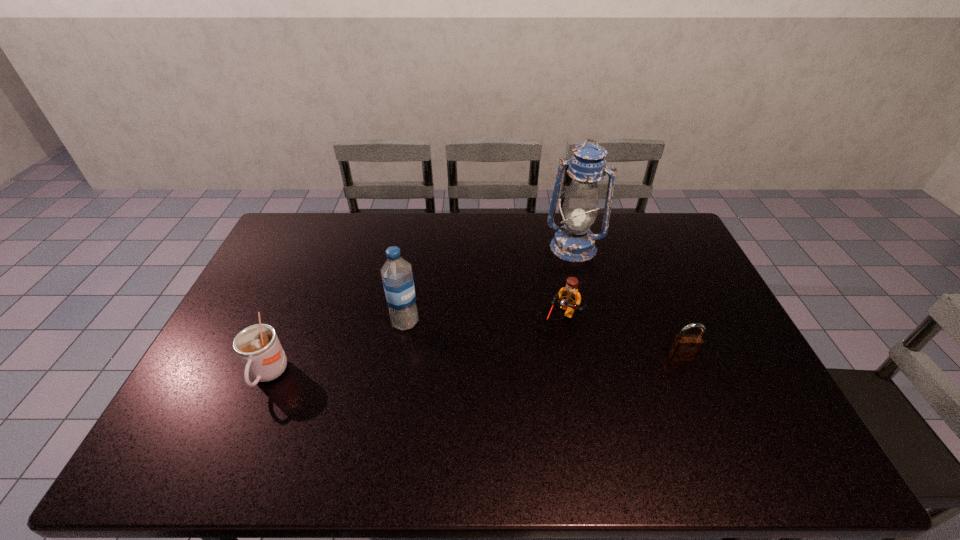
Image resolution: width=960 pixels, height=540 pixels. Identify the location of the third shortest object. (258, 347).

Identify the location of cup. (258, 347).

Find the location of a particular element. The width and height of the screenshot is (960, 540). padlock is located at coordinates pyautogui.click(x=685, y=347).

I want to click on water bottle, so click(397, 276).

The height and width of the screenshot is (540, 960). In order to click on the fourth shortest object in this screenshot , I will do `click(397, 276)`.

Locate an element on the screen. This screenshot has width=960, height=540. lantern is located at coordinates (574, 241).

Where is `the farthest object`? the farthest object is located at coordinates (574, 241).

Where is `Lego`? The height and width of the screenshot is (540, 960). Lego is located at coordinates (570, 298).

At what (x,y) coordinates should I click in order to perform the action: click on vacant area situated 0.060m on the side with the handle of the third tallest object. Please return your answer as a coordinate pair (x, y). This screenshot has height=540, width=960. Looking at the image, I should click on (248, 422).

Locate an element on the screen. The width and height of the screenshot is (960, 540). free space located 0.080m on the front-facing side of the rightmost object is located at coordinates (693, 386).